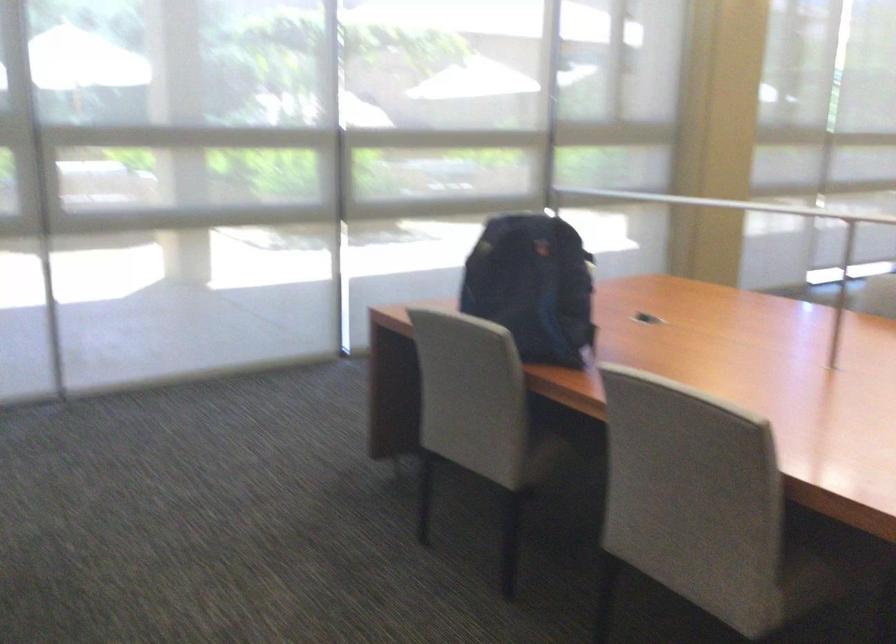
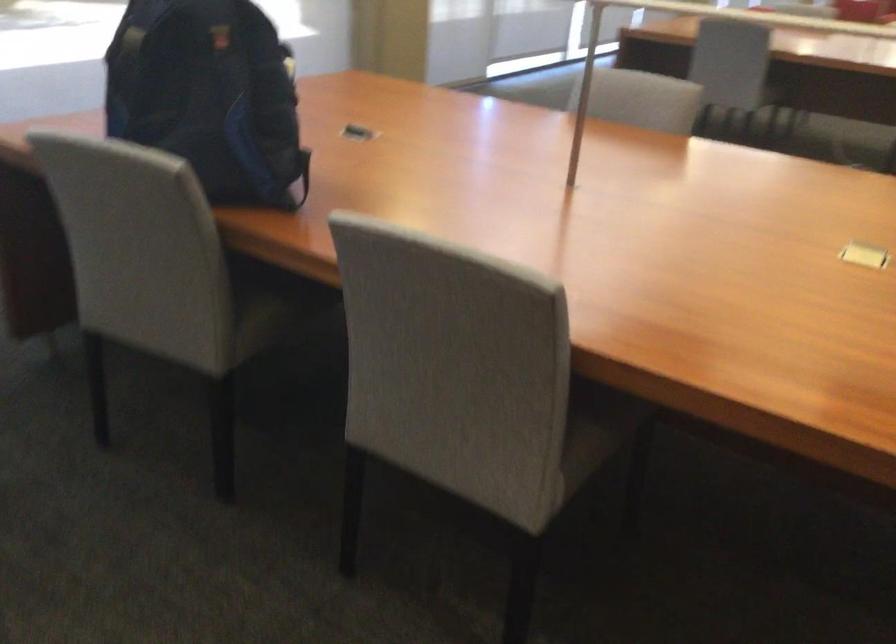
Question: The images are taken continuously from a first-person perspective. In which direction are you moving?

Choices:
 (A) Left
 (B) Right
 (C) Forward
 (D) Backward

Answer: (C)